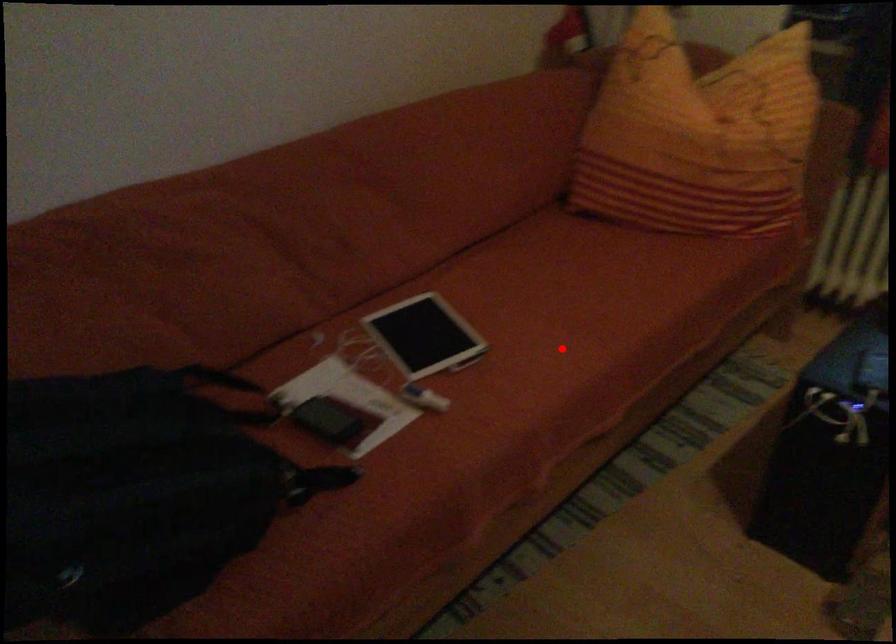
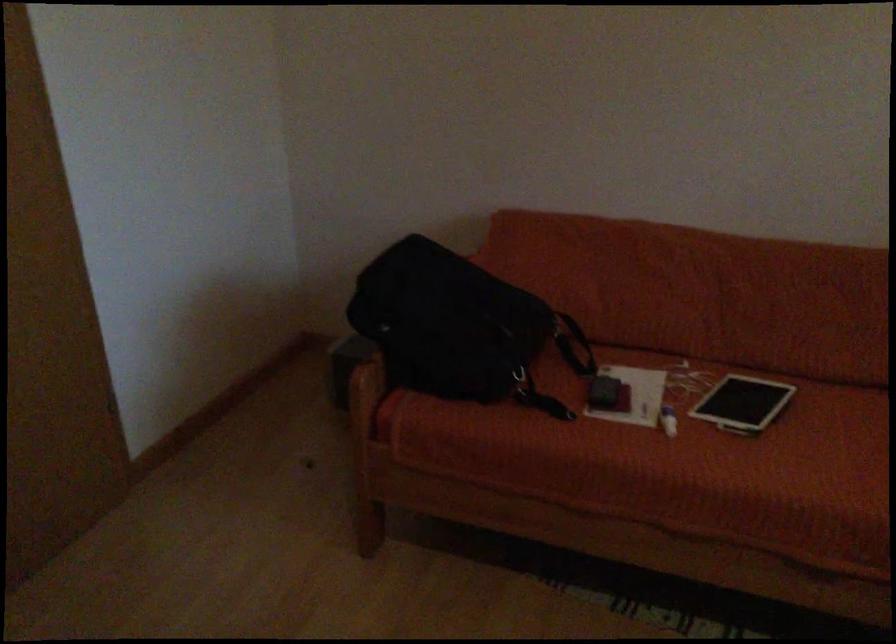
Find the pixel in the second image that matches the highlighted location in the first image.

(823, 471)